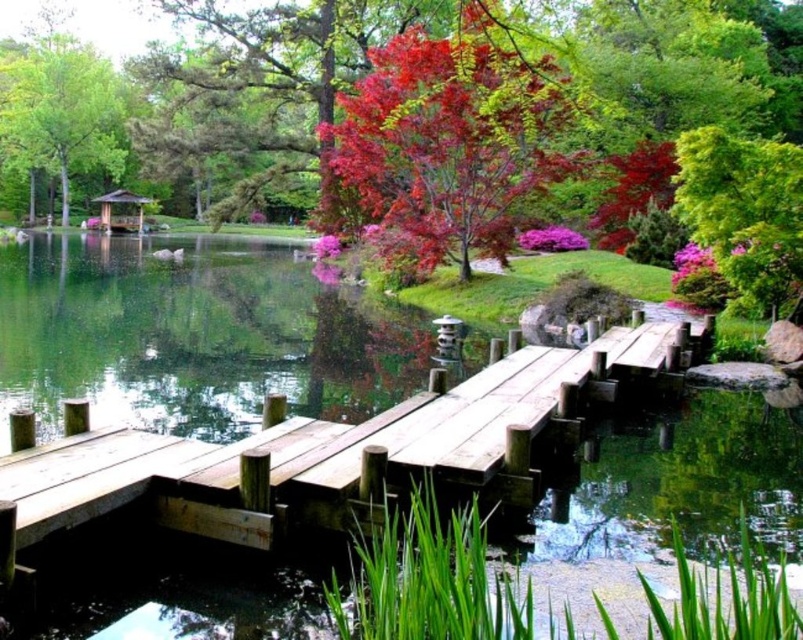
You are a bird flying over the Japanese garden and want to land on a tree. Which tree would you reach first if you fly straight towards the scene? The vivid red leaves at upper center or the green leafy tree at upper right?

The vivid red leaves at upper center would be reached first because they are positioned in front of the green leafy tree at upper right.

You are a bird flying over the Japanese garden scene. You want to land on the smallest tree between the green leafy tree at upper right and the green matte tree at upper left. Which tree should you choose?

The green leafy tree at upper right is smaller than the green matte tree at upper left, so you should choose the green leafy tree at upper right to land on.

You are standing on the wooden bridge in the Japanese garden and want to take a photo of both the green leafy tree at upper right and the green matte tree at upper left. Which tree should you frame first in your camera to ensure both are in focus?

You should frame the green leafy tree at upper right first because it is closer to you than the green matte tree at upper left, so focusing on it will help both trees remain in focus.